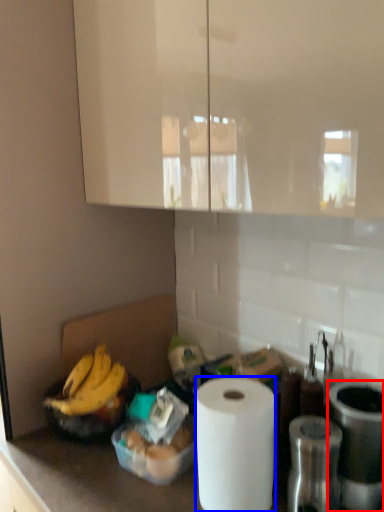
Question: Which of the following is the farthest to the observer, appliance (highlighted by a red box) or paper towel (highlighted by a blue box)?

Choices:
 (A) appliance
 (B) paper towel

Answer: (A)